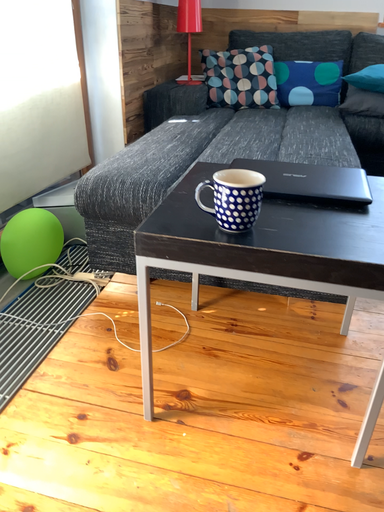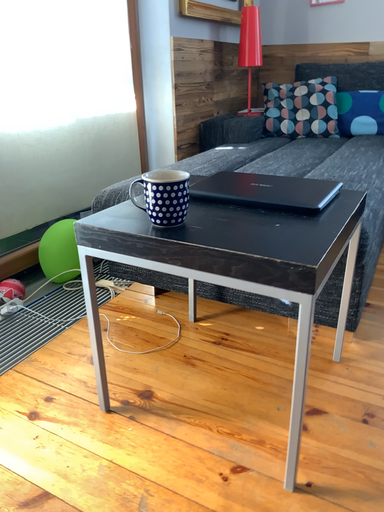
Question: Which way did the camera rotate in the video?

Choices:
 (A) rotated right
 (B) rotated left

Answer: (B)